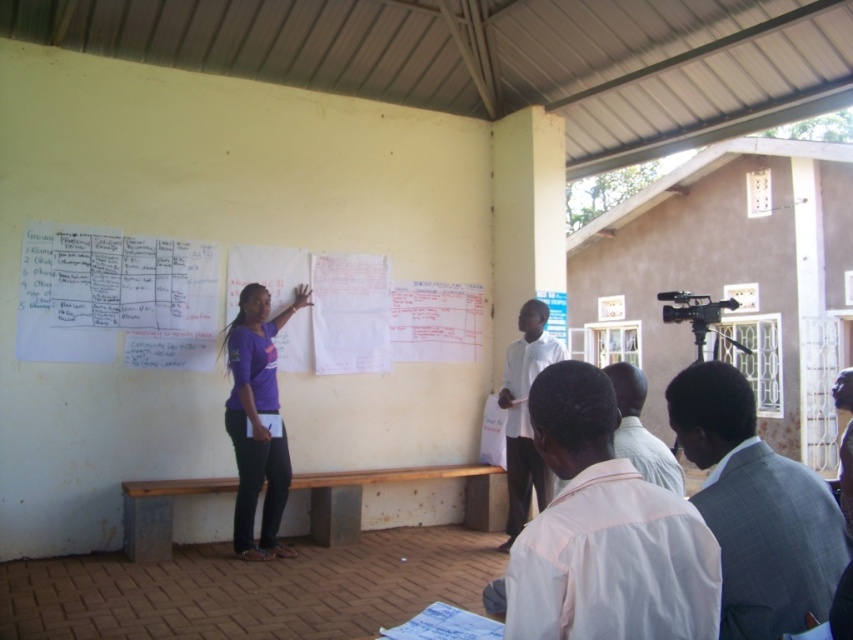
Question: Considering the relative positions of purple matte shirt at center and white matte shirt at center in the image provided, where is purple matte shirt at center located with respect to white matte shirt at center?

Choices:
 (A) above
 (B) below

Answer: (A)

Question: Which of these objects is positioned farthest from the gray checkered suit at lower right?

Choices:
 (A) white cotton shirt at lower right
 (B) purple matte shirt at center
 (C) white matte shirt at center

Answer: (B)

Question: Considering the real-world distances, which object is farthest from the white matte shirt at center?

Choices:
 (A) gray checkered suit at lower right
 (B) white shirt at lower right
 (C) white cotton shirt at lower right
 (D) purple matte shirt at center

Answer: (C)

Question: Which of the following is the closest to the observer?

Choices:
 (A) (721, 509)
 (B) (260, 401)

Answer: (A)

Question: Is gray checkered suit at lower right wider than purple matte shirt at center?

Choices:
 (A) yes
 (B) no

Answer: (A)

Question: Can you confirm if gray checkered suit at lower right is positioned above white matte shirt at center?

Choices:
 (A) yes
 (B) no

Answer: (A)